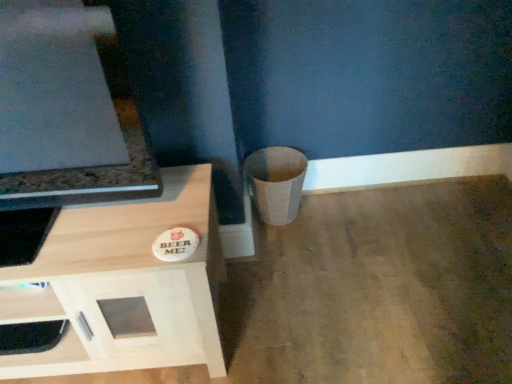
Question: Looking at their shapes, would you say white matte drawer at lower left is wider or thinner than matte beige trash can at lower right?

Choices:
 (A) thin
 (B) wide

Answer: (A)

Question: Would you say white matte drawer at lower left is to the left or to the right of matte beige trash can at lower right in the picture?

Choices:
 (A) right
 (B) left

Answer: (B)

Question: Estimate the real-world distances between objects in this image. Which object is farther from the matte beige trash can at lower right?

Choices:
 (A) light wood cabinet at lower left
 (B) white matte drawer at lower left

Answer: (B)

Question: Which object is positioned farthest from the light wood cabinet at lower left?

Choices:
 (A) white matte drawer at lower left
 (B) matte beige trash can at lower right

Answer: (B)